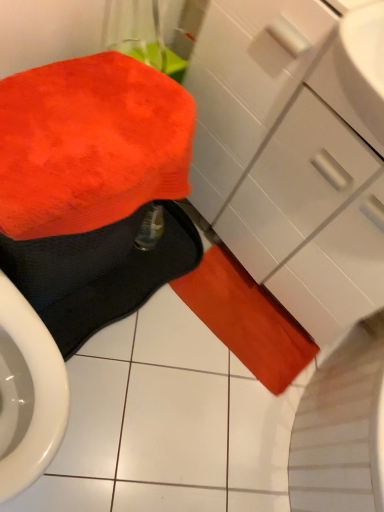
Question: From the image's perspective, relative to orange fuzzy bath towel at lower center, the 2th bath towel when ordered from back to front, is orange suede bath towel at lower center, the first bath towel in the back-to-front sequence, above or below?

Choices:
 (A) below
 (B) above

Answer: (A)

Question: In the image, is orange suede bath towel at lower center, the first bath towel in the back-to-front sequence, positioned in front of or behind orange fuzzy bath towel at lower center, the 2th bath towel when ordered from back to front?

Choices:
 (A) behind
 (B) front

Answer: (A)

Question: Estimate the real-world distances between objects in this image. Which object is closer to the matte white drawer at center-right?

Choices:
 (A) orange suede bath towel at lower center, the first bath towel in the back-to-front sequence
 (B) orange fuzzy bath towel at lower center, the 2th bath towel when ordered from back to front
 (C) fluffy orange towel at lower left, which is counted as the 3th bath towel, starting from the back

Answer: (A)

Question: Estimate the real-world distances between objects in this image. Which object is farther from the orange suede bath towel at lower center, the first bath towel in the back-to-front sequence?

Choices:
 (A) fluffy orange towel at lower left, which is counted as the 3th bath towel, starting from the back
 (B) orange fuzzy bath towel at lower center, the 2th bath towel when ordered from back to front
 (C) matte white drawer at center-right

Answer: (A)